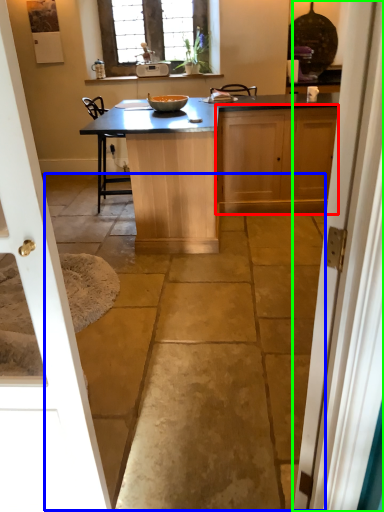
Question: Estimate the real-world distances between objects in this image. Which object is closer to cabinetry (highlighted by a red box), concrete (highlighted by a blue box) or door (highlighted by a green box)?

Choices:
 (A) concrete
 (B) door

Answer: (A)